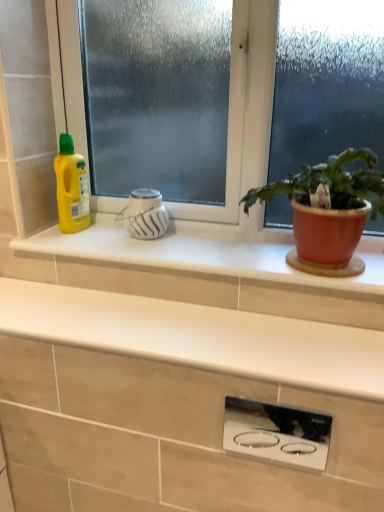
This screenshot has height=512, width=384. In order to click on vacant area that is in front of yellow plastic bottle at left in this screenshot , I will do `click(62, 245)`.